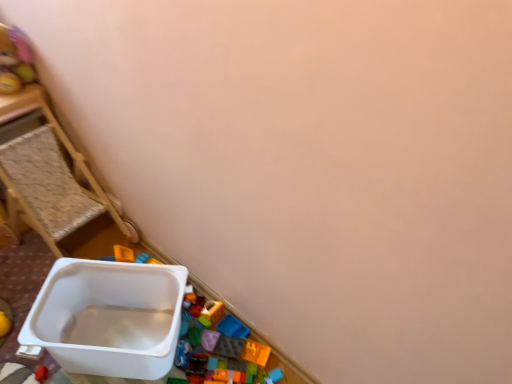
Question: Should I look upward or downward to see white plastic container at left?

Choices:
 (A) up
 (B) down

Answer: (A)

Question: From the image's perspective, is soft plush bear at upper left under white plastic container at left?

Choices:
 (A) no
 (B) yes

Answer: (A)

Question: Considering the relative sizes of soft plush bear at upper left and white plastic container at left in the image provided, is soft plush bear at upper left smaller than white plastic container at left?

Choices:
 (A) yes
 (B) no

Answer: (A)

Question: Can you confirm if soft plush bear at upper left is positioned to the right of white plastic container at left?

Choices:
 (A) yes
 (B) no

Answer: (B)

Question: Is soft plush bear at upper left facing away from white plastic container at left?

Choices:
 (A) yes
 (B) no

Answer: (B)

Question: From the image's perspective, is soft plush bear at upper left located above white plastic container at left?

Choices:
 (A) yes
 (B) no

Answer: (A)

Question: Is soft plush bear at upper left shorter than white plastic container at left?

Choices:
 (A) yes
 (B) no

Answer: (A)

Question: Is white plastic container at left turned away from soft plush bear at upper left?

Choices:
 (A) no
 (B) yes

Answer: (A)

Question: Does white plastic container at left have a greater height compared to soft plush bear at upper left?

Choices:
 (A) no
 (B) yes

Answer: (B)

Question: Is white plastic container at left not within soft plush bear at upper left?

Choices:
 (A) yes
 (B) no

Answer: (A)

Question: Is white plastic container at left shorter than soft plush bear at upper left?

Choices:
 (A) yes
 (B) no

Answer: (B)

Question: From the image's perspective, would you say white plastic container at left is positioned over soft plush bear at upper left?

Choices:
 (A) no
 (B) yes

Answer: (A)

Question: Can you confirm if white plastic container at left is positioned to the left of soft plush bear at upper left?

Choices:
 (A) no
 (B) yes

Answer: (A)

Question: Is white plastic container at left wider or thinner than soft plush bear at upper left?

Choices:
 (A) thin
 (B) wide

Answer: (B)